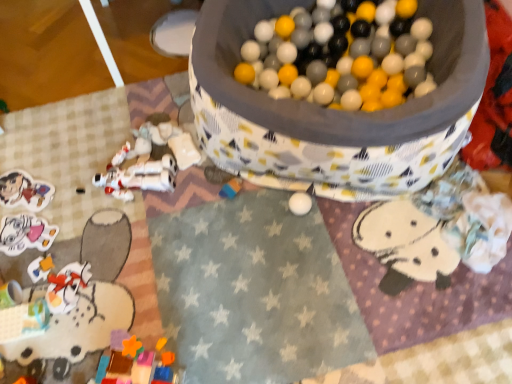
Question: Considering the relative positions of multicolored plastic blocks at center, acting as the 5th toy starting from the left, and fluffy white blanket at lower right, arranged as the 1th toy when viewed from the right, in the image provided, is multicolored plastic blocks at center, acting as the 5th toy starting from the left, to the left or to the right of fluffy white blanket at lower right, arranged as the 1th toy when viewed from the right,?

Choices:
 (A) left
 (B) right

Answer: (A)

Question: Considering the positions of point (237, 185) and point (455, 266), is point (237, 185) closer or farther from the camera than point (455, 266)?

Choices:
 (A) closer
 (B) farther

Answer: (B)

Question: Which is nearer to the plastic toy figure at lower left, positioned as the third toy in left-to-right order?

Choices:
 (A) matte white sticker at lower left, which appears as the 2th toy when viewed from the left
 (B) multicolored plastic blocks at center, acting as the 5th toy starting from the left
 (C) matte cardboard sticker at lower left, which is the first toy in left-to-right order
 (D) fluffy white blanket at lower right, which appears as the sixth toy when viewed from the left
 (E) white plastic astronaut at lower left, placed as the 3th toy when sorted from right to left

Answer: (A)

Question: Estimate the real-world distances between objects in this image. Which object is farther from the multicolored plastic blocks at center, the 2th toy positioned from the right?

Choices:
 (A) matte white sticker at lower left, the 5th toy when ordered from right to left
 (B) fluffy white blanket at lower right, arranged as the 1th toy when viewed from the right
 (C) matte cardboard sticker at lower left, which is the sixth toy from right to left
 (D) plastic toy figure at lower left, positioned as the third toy in left-to-right order
 (E) white plastic astronaut at lower left, placed as the 3th toy when sorted from right to left

Answer: (C)